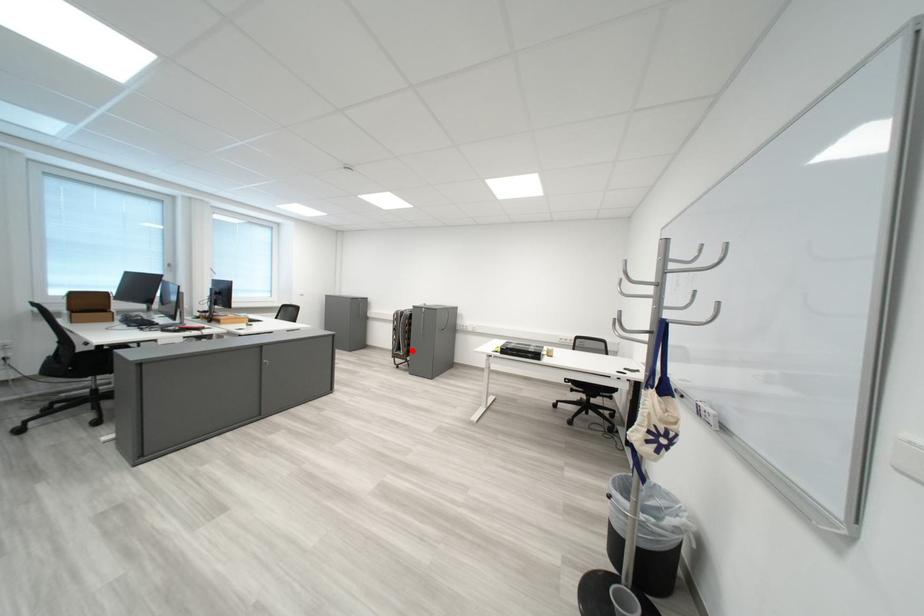
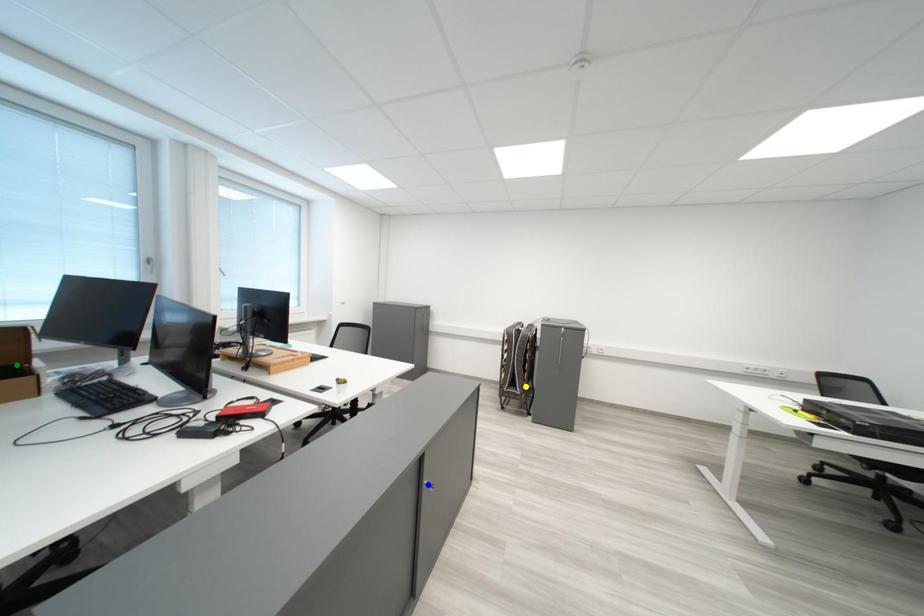
Question: I am providing you with two images of the same scene from different viewpoints. A red point is marked on the first image. You are given multiple points on the second image. Can you choose the point in image 2 that corresponds to the point in image 1?

Choices:
 (A) blue point
 (B) yellow point
 (C) green point

Answer: (B)